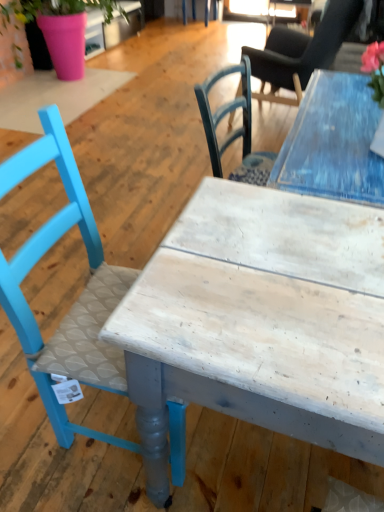
What do you see at coordinates (59, 27) in the screenshot? I see `pink matte pot at upper left` at bounding box center [59, 27].

The image size is (384, 512). I want to click on pink matte pot at upper left, so click(59, 27).

Considering the sizes of smooth black chair at upper right, acting as the first chair starting from the back, and pink matte pot at upper left in the image, is smooth black chair at upper right, acting as the first chair starting from the back, wider or thinner than pink matte pot at upper left?

Considering their sizes, smooth black chair at upper right, acting as the first chair starting from the back, looks slimmer than pink matte pot at upper left.

Is point (272, 89) closer or farther from the camera than point (59, 17)?

Point (272, 89).

From a real-world perspective, is smooth black chair at upper right, the 1th chair when ordered from top to bottom, positioned above or below pink matte pot at upper left?

smooth black chair at upper right, the 1th chair when ordered from top to bottom, is above pink matte pot at upper left.

Is matte blue chair at left, placed as the first chair when sorted from front to back, closer to the viewer compared to pink matte pot at upper left?

Yes, it is in front of pink matte pot at upper left.

Considering the points (47, 405) and (72, 74), which point is behind, point (47, 405) or point (72, 74)?

The point (72, 74) is more distant.

In the scene shown: Is matte blue chair at left, placed as the first chair when sorted from front to back, directly adjacent to pink matte pot at upper left?

No, matte blue chair at left, placed as the first chair when sorted from front to back, is not touching pink matte pot at upper left.

In the scene shown: Looking at their sizes, would you say pink matte pot at upper left is wider or thinner than white wood table at center?

Clearly, pink matte pot at upper left has more width compared to white wood table at center.

From the image's perspective, is pink matte pot at upper left located beneath white wood table at center?

Actually, pink matte pot at upper left appears above white wood table at center in the image.

Is the position of pink matte pot at upper left less distant than that of white wood table at center?

No, the depth of pink matte pot at upper left is greater than that of white wood table at center.

Locate an element on the screen. table located below the pink matte pot at upper left (from the image's perspective) is located at coordinates (265, 316).

How many degrees apart are the facing directions of pink matte pot at upper left and smooth black chair at upper right, arranged as the 2th chair when ordered from the bottom?

There is a 172-degree angle between the facing directions of pink matte pot at upper left and smooth black chair at upper right, arranged as the 2th chair when ordered from the bottom.

Between point (54, 59) and point (282, 76), which one is positioned in front?

Point (282, 76)

Is pink matte pot at upper left positioned behind smooth black chair at upper right, arranged as the 2th chair when ordered from the bottom?

Yes, pink matte pot at upper left is behind smooth black chair at upper right, arranged as the 2th chair when ordered from the bottom.

From the image's perspective, which is above, pink matte pot at upper left or matte blue chair at left, placed as the second chair when sorted from right to left?

pink matte pot at upper left, from the image's perspective.

Is pink matte pot at upper left positioned with its back to matte blue chair at left, which ranks as the first chair in left-to-right order?

No.

Which of these two, pink matte pot at upper left or matte blue chair at left, placed as the first chair when sorted from front to back, is wider?

With larger width is pink matte pot at upper left.

Based on the photo, which is more to the right, pink matte pot at upper left or matte blue chair at left, the 1th chair ordered from the bottom?

From the viewer's perspective, matte blue chair at left, the 1th chair ordered from the bottom, appears more on the right side.

Considering the sizes of objects white wood table at center and pink matte pot at upper left in the image provided, who is bigger, white wood table at center or pink matte pot at upper left?

pink matte pot at upper left is bigger.

Between point (235, 192) and point (80, 49), which one is positioned behind?

The point (80, 49) is farther.

Based on the photo, how distant is white wood table at center from pink matte pot at upper left?

3.75 meters.

Between white wood table at center and pink matte pot at upper left, which one appears on the right side from the viewer's perspective?

From the viewer's perspective, white wood table at center appears more on the right side.

Looking at this image, is smooth black chair at upper right, positioned as the second chair in front-to-back order, inside the boundaries of white wood table at center, or outside?

smooth black chair at upper right, positioned as the second chair in front-to-back order, is spatially situated outside white wood table at center.

The width and height of the screenshot is (384, 512). I want to click on table below the smooth black chair at upper right, the 1th chair when ordered from top to bottom (from the image's perspective), so click(x=265, y=316).

From a real-world perspective, is smooth black chair at upper right, the 1th chair in the right-to-left sequence, located higher than white wood table at center?

Indeed, from a real-world perspective, smooth black chair at upper right, the 1th chair in the right-to-left sequence, stands above white wood table at center.

In the scene shown: Between smooth black chair at upper right, the 1th chair when ordered from top to bottom, and white wood table at center, which one is positioned behind?

smooth black chair at upper right, the 1th chair when ordered from top to bottom, is more distant.

There is a pink matte pot at upper left. Where is `the 1st chair below it (from the image's perspective)`? Image resolution: width=384 pixels, height=512 pixels. the 1st chair below it (from the image's perspective) is located at coordinates (301, 52).

What are the coordinates of `houseplant behind the matte blue chair at left, which ranks as the first chair in left-to-right order` in the screenshot? It's located at (59, 27).

When comparing their distances from matte blue chair at left, which ranks as the first chair in left-to-right order, does pink matte pot at upper left or white wood table at center seem closer?

Among the two, white wood table at center is located nearer to matte blue chair at left, which ranks as the first chair in left-to-right order.

Considering their positions, is pink matte pot at upper left positioned further to matte blue chair at left, placed as the second chair when sorted from right to left, than smooth black chair at upper right, the 1th chair when ordered from top to bottom?

pink matte pot at upper left.

Looking at the image, which one is located closer to pink matte pot at upper left, white wood table at center or matte blue chair at left, placed as the 2th chair when sorted from back to front?

matte blue chair at left, placed as the 2th chair when sorted from back to front, is positioned closer to the anchor pink matte pot at upper left.

From the image, which object appears to be nearer to smooth black chair at upper right, acting as the first chair starting from the back, matte blue chair at left, placed as the second chair when sorted from right to left, or white wood table at center?

Among the two, white wood table at center is located nearer to smooth black chair at upper right, acting as the first chair starting from the back.

When comparing their distances from smooth black chair at upper right, the 1th chair when ordered from top to bottom, does matte blue chair at left, placed as the 2th chair when sorted from back to front, or pink matte pot at upper left seem closer?

Based on the image, pink matte pot at upper left appears to be nearer to smooth black chair at upper right, the 1th chair when ordered from top to bottom.

Which object lies further to the anchor point matte blue chair at left, placed as the second chair when sorted from right to left, smooth black chair at upper right, positioned as the second chair in front-to-back order, or white wood table at center?

Based on the image, smooth black chair at upper right, positioned as the second chair in front-to-back order, appears to be further to matte blue chair at left, placed as the second chair when sorted from right to left.

Looking at the image, which one is located closer to pink matte pot at upper left, white wood table at center or smooth black chair at upper right, positioned as the second chair in front-to-back order?

Among the two, smooth black chair at upper right, positioned as the second chair in front-to-back order, is located nearer to pink matte pot at upper left.

Based on the photo, based on their spatial positions, is smooth black chair at upper right, positioned as the second chair in front-to-back order, or pink matte pot at upper left further from white wood table at center?

pink matte pot at upper left is further to white wood table at center.

Locate an element on the screen. chair located between white wood table at center and smooth black chair at upper right, acting as the first chair starting from the back, in the depth direction is located at coordinates (x=78, y=298).

Where is `chair located between matte blue chair at left, placed as the 2th chair when sorted from back to front, and pink matte pot at upper left in the depth direction`? chair located between matte blue chair at left, placed as the 2th chair when sorted from back to front, and pink matte pot at upper left in the depth direction is located at coordinates (301, 52).